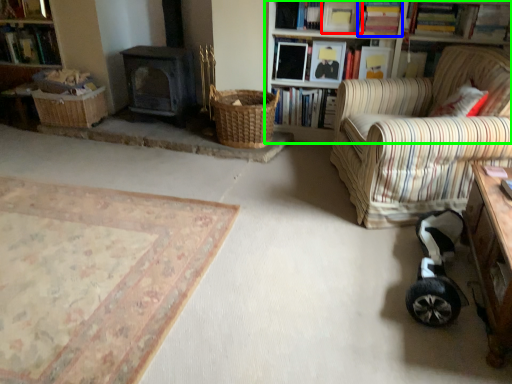
Question: Based on their relative distances, which object is farther from book (highlighted by a red box)? Choose from book (highlighted by a blue box) and bookcase (highlighted by a green box).

Choices:
 (A) book
 (B) bookcase

Answer: (B)